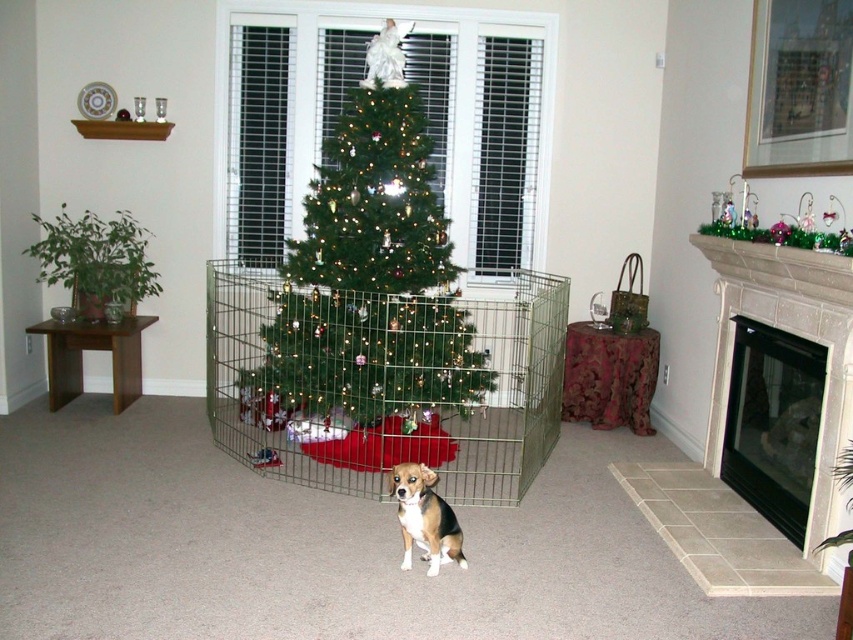
Question: Can you confirm if white marble fireplace at right is positioned to the right of black glass fireplace at lower right?

Choices:
 (A) no
 (B) yes

Answer: (A)

Question: Considering the relative positions of metallic wire cage at center and green matte christmas tree at center in the image provided, where is metallic wire cage at center located with respect to green matte christmas tree at center?

Choices:
 (A) above
 (B) below

Answer: (B)

Question: Which object is farther from the camera taking this photo?

Choices:
 (A) metallic wire cage at center
 (B) brown and white fur dog at center
 (C) black glass fireplace at lower right

Answer: (A)

Question: Which point is farther to the camera?

Choices:
 (A) metallic wire cage at center
 (B) white marble fireplace at right

Answer: (A)

Question: Can you confirm if metallic wire cage at center is positioned below brown and white fur dog at center?

Choices:
 (A) yes
 (B) no

Answer: (B)

Question: Which object is closer to the camera taking this photo?

Choices:
 (A) green matte christmas tree at center
 (B) brown and white fur dog at center

Answer: (B)